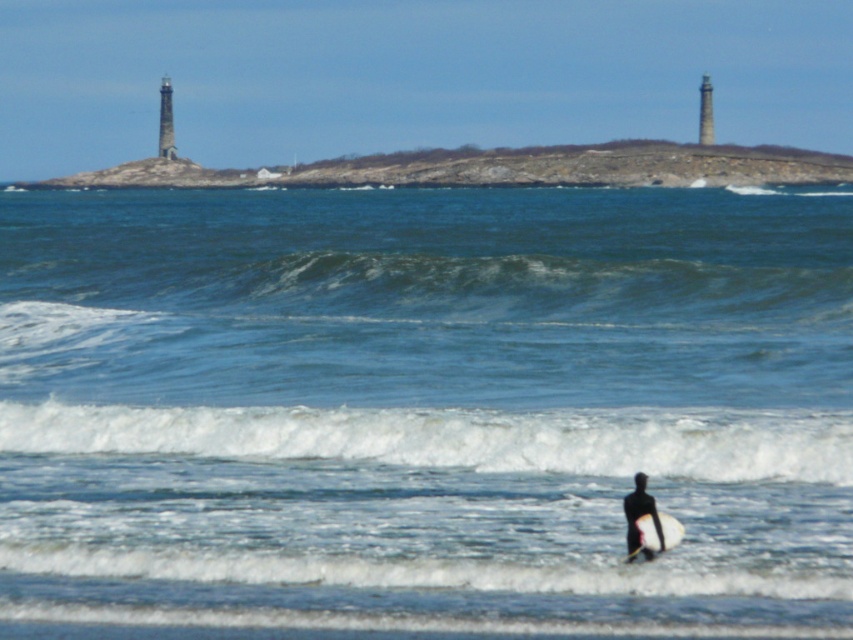
You are a surfer trying to paddle out to the open ocean. You see the white foamy wave at lower center and the rocky island at center. Which one is narrower in width?

The white foamy wave at lower center is thinner than the rocky island at center, so the white foamy wave at lower center is narrower in width.

You are a photographer trying to capture the white foamy wave at lower center and the white foam surfboard at lower center. Based on their sizes, which one do you think would appear larger in your photo?

The white foamy wave at lower center might be wider than white foam surfboard at lower center, so it would likely appear larger in the photo.